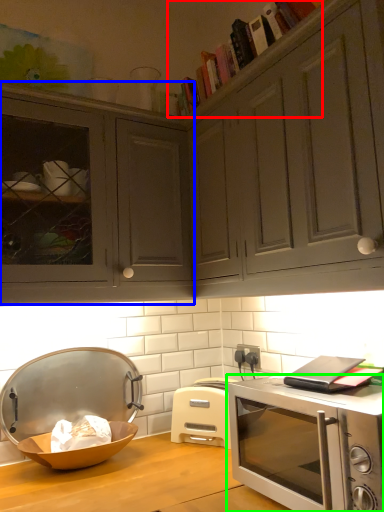
Question: Estimate the real-world distances between objects in this image. Which object is farther from book (highlighted by a red box), cabinetry (highlighted by a blue box) or microwave oven (highlighted by a green box)?

Choices:
 (A) cabinetry
 (B) microwave oven

Answer: (B)